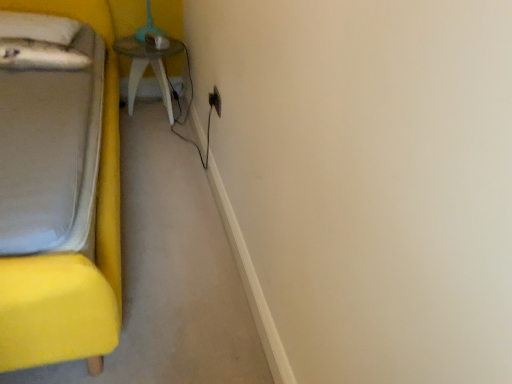
Question: Is white soft pillow at upper left facing away from wooden table at center?

Choices:
 (A) no
 (B) yes

Answer: (A)

Question: Would you say white soft pillow at upper left is outside wooden table at center?

Choices:
 (A) yes
 (B) no

Answer: (A)

Question: From the image's perspective, is white soft pillow at upper left below wooden table at center?

Choices:
 (A) yes
 (B) no

Answer: (B)

Question: Does white soft pillow at upper left have a lesser width compared to wooden table at center?

Choices:
 (A) no
 (B) yes

Answer: (A)

Question: From a real-world perspective, does white soft pillow at upper left stand above wooden table at center?

Choices:
 (A) no
 (B) yes

Answer: (B)

Question: Is the depth of white soft pillow at upper left less than that of wooden table at center?

Choices:
 (A) yes
 (B) no

Answer: (A)

Question: Is white soft pillow at upper left a part of yellow fabric bed at left?

Choices:
 (A) yes
 (B) no

Answer: (A)

Question: Does yellow fabric bed at left appear on the right side of white soft pillow at upper left?

Choices:
 (A) yes
 (B) no

Answer: (A)

Question: From the image's perspective, is yellow fabric bed at left on top of white soft pillow at upper left?

Choices:
 (A) yes
 (B) no

Answer: (B)

Question: Is yellow fabric bed at left aimed at white soft pillow at upper left?

Choices:
 (A) no
 (B) yes

Answer: (A)

Question: Considering the relative sizes of yellow fabric bed at left and white soft pillow at upper left in the image provided, is yellow fabric bed at left bigger than white soft pillow at upper left?

Choices:
 (A) yes
 (B) no

Answer: (A)

Question: Is yellow fabric bed at left with white soft pillow at upper left?

Choices:
 (A) yes
 (B) no

Answer: (B)

Question: Is white soft pillow at upper left located outside black plastic electric outlet at upper center?

Choices:
 (A) yes
 (B) no

Answer: (A)